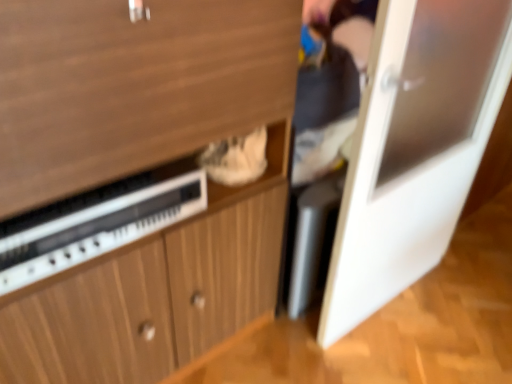
Identify the location of vacant space in front of white glossy door at right. (411, 352).